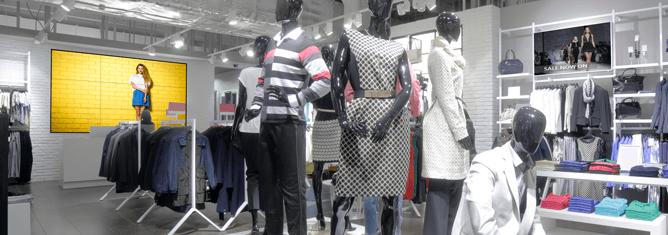
Locate an element on the screen. gray floor is located at coordinates (97, 207).